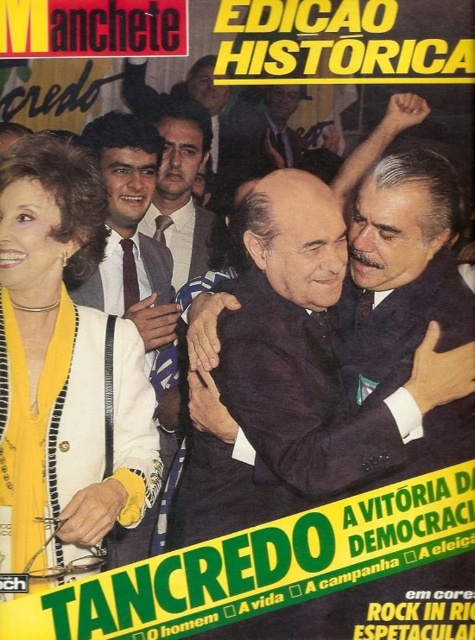
You are a photographer reviewing the magazine cover. You need to determine which object is nearer to you between the dark suit at center and the dark brown tie at left. Which one is closer?

The dark suit at center is closer to the viewer than the dark brown tie at left.

You are a photographer standing at the back of the scene. You want to take a photo of the dark suit at center and the dark brown tie at left. Can you fit both in your camera frame which has a maximum width of 1 meter?

The dark suit at center is 93.01 centimeters away from the dark brown tie at left. Since the distance between them is less than 1 meter, both can fit within the camera frame.

Looking at the magazine cover for Manchete, you see the dark suit at center and the yellow fabric at left. Which object is positioned to the left of the other?

The yellow fabric at left is to the left of the dark suit at center.